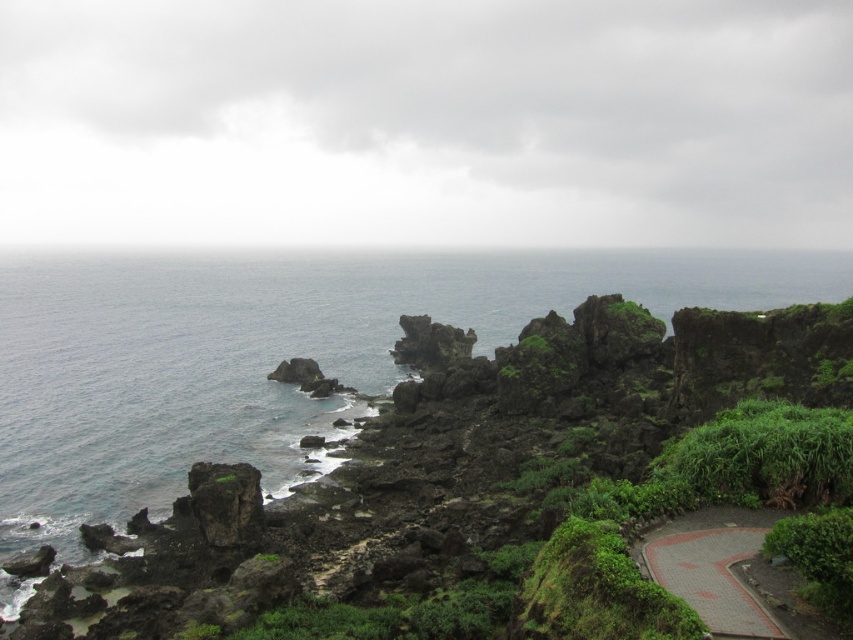
Between blue water at center and paved brick path at lower right, which one has less height?

paved brick path at lower right

Who is more forward, (28, 493) or (693, 570)?

Positioned in front is point (693, 570).

This screenshot has width=853, height=640. I want to click on blue water at center, so 271,353.